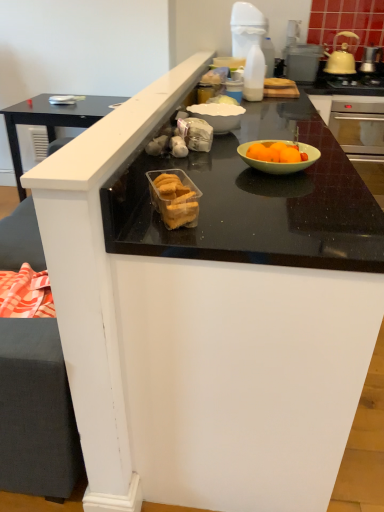
Where is `metallic silver toaster at upper right`? metallic silver toaster at upper right is located at coordinates (302, 62).

What do you see at coordinates (341, 57) in the screenshot? This screenshot has height=512, width=384. I see `yellow ceramic kettle at upper right` at bounding box center [341, 57].

The width and height of the screenshot is (384, 512). I want to click on metallic silver toaster at upper right, so point(302,62).

In terms of height, does translucent plastic container of cookies at center look taller or shorter compared to black glass gas stove at upper right?

Considering their sizes, translucent plastic container of cookies at center has more height than black glass gas stove at upper right.

How many degrees apart are the facing directions of translucent plastic container of cookies at center and black glass gas stove at upper right?

87.8 degrees.

The image size is (384, 512). What are the coordinates of `food on the left of black glass gas stove at upper right` in the screenshot? It's located at (174, 198).

Is point (170, 170) behind point (354, 87)?

No.

From the image's perspective, which is above, black glass gas stove at upper right or translucent plastic container of cookies at center?

From the image's view, black glass gas stove at upper right is above.

From a real-world perspective, is black glass gas stove at upper right above or below translucent plastic container of cookies at center?

black glass gas stove at upper right is situated lower than translucent plastic container of cookies at center in the real world.

Where is `gas stove above the translucent plastic container of cookies at center (from the image's perspective)`? gas stove above the translucent plastic container of cookies at center (from the image's perspective) is located at coordinates (355, 81).

Which object is further away from the camera, black glass gas stove at upper right or translucent plastic container of cookies at center?

black glass gas stove at upper right is further from the camera.

From a real-world perspective, does translucent plastic container of cookies at center stand above metallic silver toaster at upper right?

No, from a real-world perspective, translucent plastic container of cookies at center is not over metallic silver toaster at upper right

Can you tell me how much translucent plastic container of cookies at center and metallic silver toaster at upper right differ in facing direction?

The facing directions of translucent plastic container of cookies at center and metallic silver toaster at upper right are 87.8 degrees apart.

The image size is (384, 512). I want to click on food lying in front of the metallic silver toaster at upper right, so click(x=174, y=198).

The image size is (384, 512). I want to click on appliance on the left of the yellow ceramic kettle at upper right, so click(302, 62).

Which object is positioned more to the left, metallic silver toaster at upper right or yellow ceramic kettle at upper right?

Positioned to the left is metallic silver toaster at upper right.

Is yellow ceramic kettle at upper right completely or partially inside metallic silver toaster at upper right?

No, yellow ceramic kettle at upper right is not a part of metallic silver toaster at upper right.

Based on their sizes in the image, would you say metallic silver toaster at upper right is bigger or smaller than yellow ceramic kettle at upper right?

Considering their sizes, metallic silver toaster at upper right takes up more space than yellow ceramic kettle at upper right.

Is yellow ceramic kettle at upper right surrounded by translucent plastic container of cookies at center?

That's incorrect, yellow ceramic kettle at upper right is not inside translucent plastic container of cookies at center.

Does translucent plastic container of cookies at center have a greater width compared to yellow ceramic kettle at upper right?

No.

How distant is translucent plastic container of cookies at center from yellow ceramic kettle at upper right?

They are 7.17 feet apart.

Where is `kitchen appliance that appears on the right of translucent plastic container of cookies at center`? kitchen appliance that appears on the right of translucent plastic container of cookies at center is located at coordinates (341, 57).

Can you confirm if metallic silver toaster at upper right is smaller than translucent plastic container of cookies at center?

Incorrect, metallic silver toaster at upper right is not smaller in size than translucent plastic container of cookies at center.

Does metallic silver toaster at upper right turn towards translucent plastic container of cookies at center?

Yes.

Does metallic silver toaster at upper right have a lesser height compared to translucent plastic container of cookies at center?

No, metallic silver toaster at upper right is not shorter than translucent plastic container of cookies at center.

Between yellow ceramic kettle at upper right and metallic silver toaster at upper right, which one appears on the left side from the viewer's perspective?

metallic silver toaster at upper right.

Are yellow ceramic kettle at upper right and metallic silver toaster at upper right making contact?

yellow ceramic kettle at upper right is not next to metallic silver toaster at upper right, and they're not touching.

Between point (344, 31) and point (307, 64), which one is positioned in front?

The point (307, 64) is more forward.

This screenshot has height=512, width=384. Find the location of `appliance below the yellow ceramic kettle at upper right (from the image's perspective)`. appliance below the yellow ceramic kettle at upper right (from the image's perspective) is located at coordinates (302, 62).

Find the location of a particular element. The height and width of the screenshot is (512, 384). food on the left of black glass gas stove at upper right is located at coordinates (174, 198).

The width and height of the screenshot is (384, 512). I want to click on gas stove below the translucent plastic container of cookies at center (from a real-world perspective), so click(x=355, y=81).

Looking at the image, which one is located closer to black glass gas stove at upper right, translucent plastic container of cookies at center or metallic silver toaster at upper right?

metallic silver toaster at upper right lies closer to black glass gas stove at upper right than the other object.

From the image, which object appears to be nearer to metallic silver toaster at upper right, black glass gas stove at upper right or yellow ceramic kettle at upper right?

yellow ceramic kettle at upper right is positioned closer to the anchor metallic silver toaster at upper right.

Consider the image. Looking at the image, which one is located closer to translucent plastic container of cookies at center, black glass gas stove at upper right or yellow ceramic kettle at upper right?

Among the two, black glass gas stove at upper right is located nearer to translucent plastic container of cookies at center.

Based on their spatial positions, is yellow ceramic kettle at upper right or translucent plastic container of cookies at center further from black glass gas stove at upper right?

translucent plastic container of cookies at center is positioned further to the anchor black glass gas stove at upper right.

Estimate the real-world distances between objects in this image. Which object is closer to metallic silver toaster at upper right, translucent plastic container of cookies at center or yellow ceramic kettle at upper right?

Based on the image, yellow ceramic kettle at upper right appears to be nearer to metallic silver toaster at upper right.

Looking at this image, based on their spatial positions, is metallic silver toaster at upper right or translucent plastic container of cookies at center closer to black glass gas stove at upper right?

The object closer to black glass gas stove at upper right is metallic silver toaster at upper right.

When comparing their distances from black glass gas stove at upper right, does translucent plastic container of cookies at center or yellow ceramic kettle at upper right seem further?

translucent plastic container of cookies at center lies further to black glass gas stove at upper right than the other object.

Which object lies further to the anchor point black glass gas stove at upper right, yellow ceramic kettle at upper right or metallic silver toaster at upper right?

Among the two, metallic silver toaster at upper right is located further to black glass gas stove at upper right.

Identify the location of gas stove positioned between translucent plastic container of cookies at center and metallic silver toaster at upper right from near to far. (355, 81).

Identify the location of kitchen appliance between metallic silver toaster at upper right and black glass gas stove at upper right in the horizontal direction. This screenshot has height=512, width=384. (341, 57).

Where is `gas stove between translucent plastic container of cookies at center and yellow ceramic kettle at upper right in the front-back direction`? The width and height of the screenshot is (384, 512). gas stove between translucent plastic container of cookies at center and yellow ceramic kettle at upper right in the front-back direction is located at coordinates (355, 81).

Where is `kitchen appliance positioned between translucent plastic container of cookies at center and metallic silver toaster at upper right from near to far`? kitchen appliance positioned between translucent plastic container of cookies at center and metallic silver toaster at upper right from near to far is located at coordinates (341, 57).